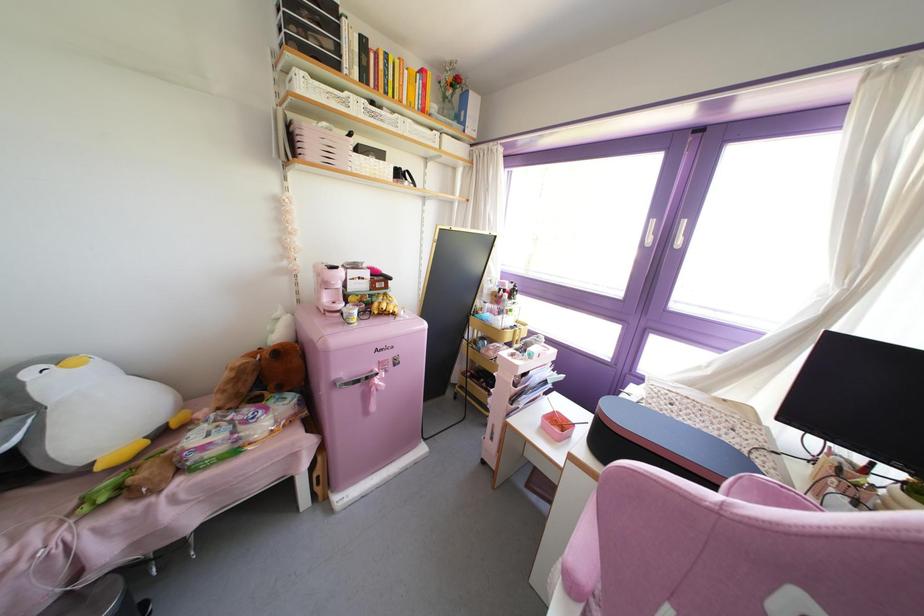
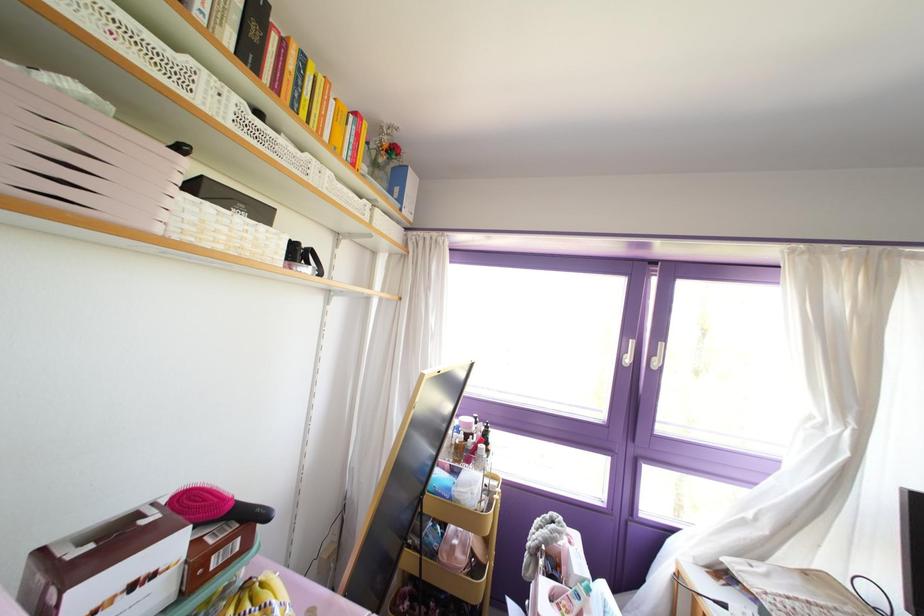
Where in the second image is the point corresponding to pixel 336 164 from the first image?

(107, 208)